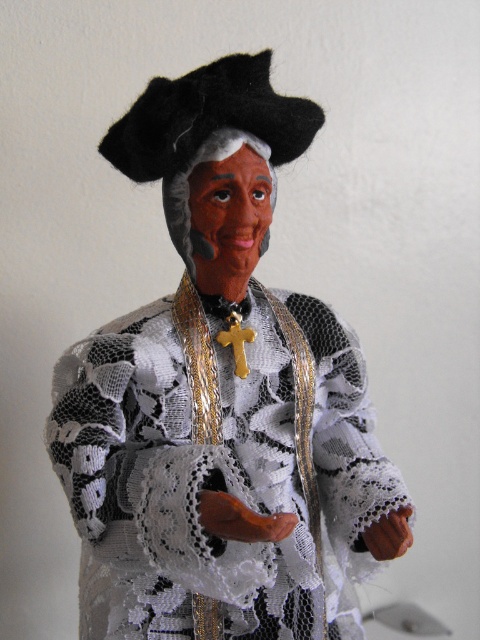
You are an art restorer examining the figurine. You need to apply a protective coating to the white lace dress at center and the matte black face at center. Which object should you treat first if you start from the left side of the figurine?

The matte black face at center should be treated first because it is located to the left of the white lace dress at center.

You are an art conservator examining the figurine. You need to determine the order of the white lace dress at center and the matte black face at center from top to bottom. Which is positioned higher?

The matte black face at center is positioned higher than the white lace dress at center, as the white lace dress at center is located below it.